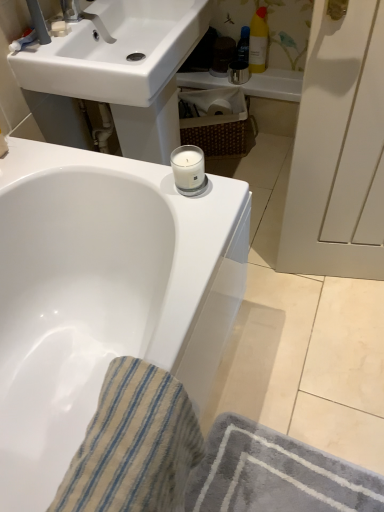
Identify the location of free space in front of translucent plastic bottle at upper right, positioned as the second toiletry in right-to-left order. (270, 80).